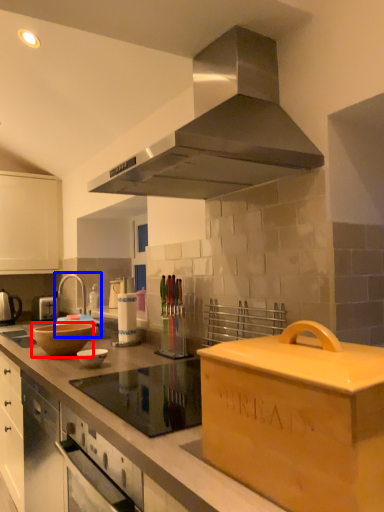
Question: Among these objects, which one is nearest to the camera, mixing bowl (highlighted by a red box) or sink (highlighted by a blue box)?

Choices:
 (A) mixing bowl
 (B) sink

Answer: (A)